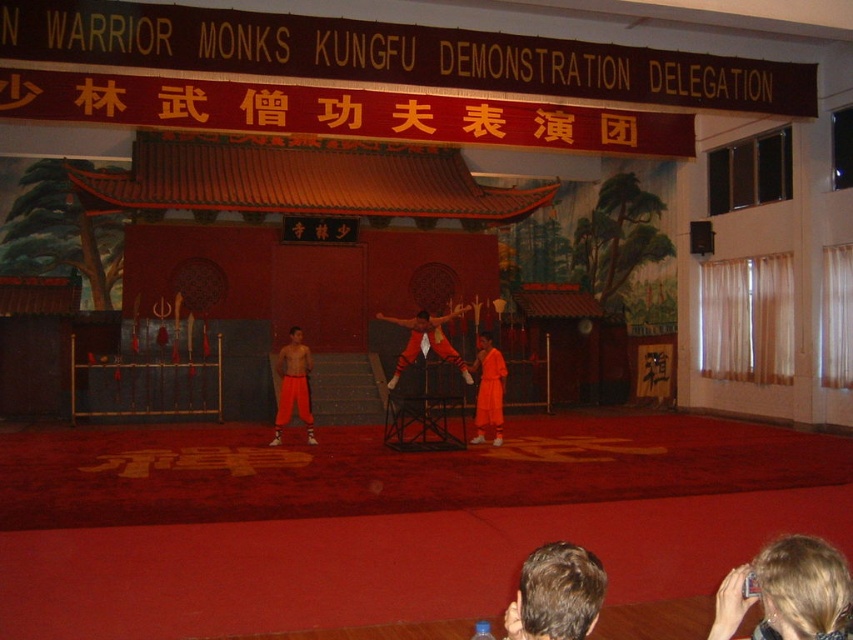
You are a photographer at the event and want to capture the matte red pants at center in your photo. Where should you position your camera to ensure it is centered in the frame?

To center the matte red pants at center in the frame, position your camera at point coordinates approximately 0.534 on the x axis and 0.501 on the y axis.

Looking at this image, you are a photographer standing at the back of the stage. You want to take a photo of the brown hair at lower center and the matte red pants at center. The camera you are using has a maximum focus range of 30 feet. Will you be able to capture both subjects clearly in the same photo?

The brown hair at lower center is 38.05 feet from matte red pants at center. Since the distance between them exceeds the camera maximum focus range of 30 feet, you will not be able to capture both subjects clearly in the same photo.